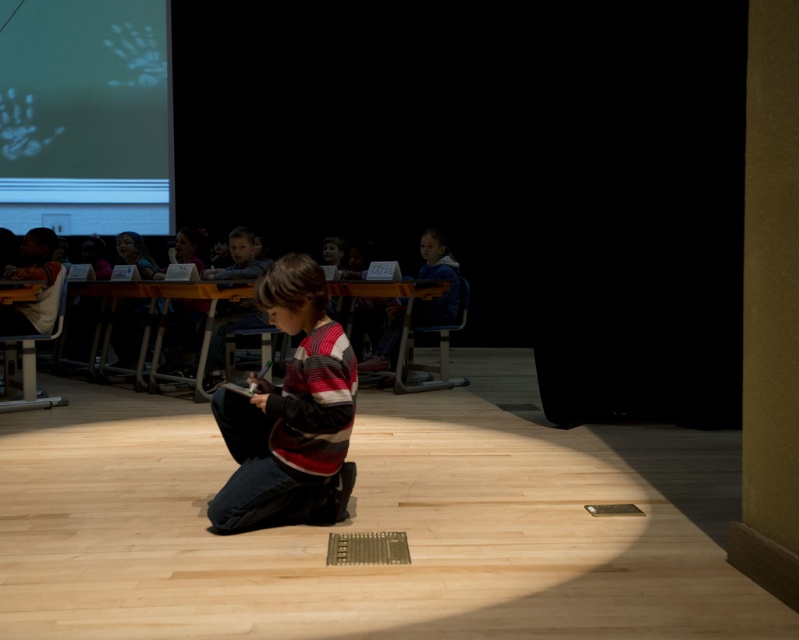
You are a student in the classroom and want to show your tablet to the class. The tablet is the same size as the striped sweater at center. Can you hold the tablet up so that everyone can see it clearly from the white matte projection screen at upper left?

The white matte projection screen at upper left is bigger than the striped sweater at center. Since the tablet is the same size as the striped sweater at center, it would be smaller than the screen. Therefore, holding the tablet up near the screen should allow everyone to see it clearly.

You are a teacher in the classroom. You want to place a small sticker exactly at the point with coordinates (x=289, y=413). Which object should you place the sticker on?

The point with coordinates (x=289, y=413) is on the striped sweater at center, so you should place the sticker on the striped sweater at center.